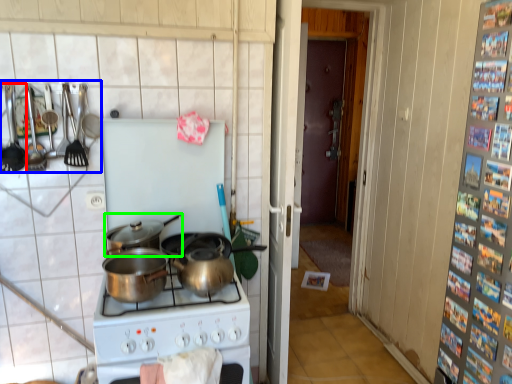
Question: Which object is the closest to the kitchen appliance (highlighted by a red box)? Choose among these: kitchen appliance (highlighted by a blue box) or kitchen appliance (highlighted by a green box).

Choices:
 (A) kitchen appliance
 (B) kitchen appliance

Answer: (A)